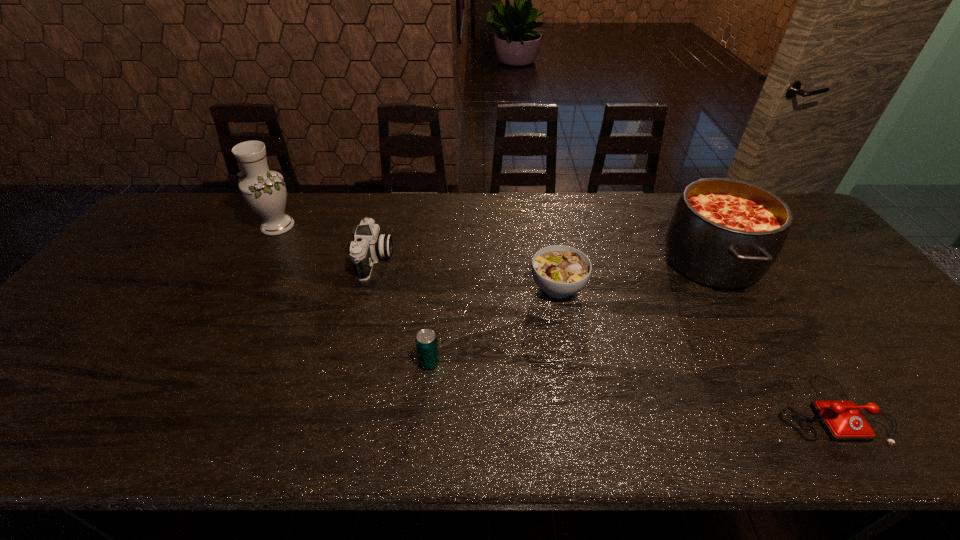
Find the location of a particular element. This screenshot has width=960, height=540. vacant space at the left edge is located at coordinates (24, 368).

Find the location of a particular element. This screenshot has height=540, width=960. vacant space at the right edge of the desktop is located at coordinates (818, 259).

The image size is (960, 540). Identify the location of vacant space at the far left corner. (177, 197).

Identify the location of empty location between the third object from right to left and the tallest object. The width and height of the screenshot is (960, 540). (418, 256).

Find the location of a particular element. The image size is (960, 540). vacant space in between the fifth object from right to left and the telephone is located at coordinates (602, 334).

Where is `free space between the second object from left to right and the leftmost object`? free space between the second object from left to right and the leftmost object is located at coordinates (326, 243).

Identify the location of free space between the leftmost object and the nearest object. (554, 317).

At what (x,y) coordinates should I click in order to perform the action: click on unoccupied position between the second tallest object and the fourth object from right to left. Please return your answer as a coordinate pair (x, y). Looking at the image, I should click on (570, 311).

Find the location of `empty space between the casserole and the second nearest object`. empty space between the casserole and the second nearest object is located at coordinates (570, 311).

Locate an element on the screen. The image size is (960, 540). free space between the fourth object from left to right and the telephone is located at coordinates (694, 348).